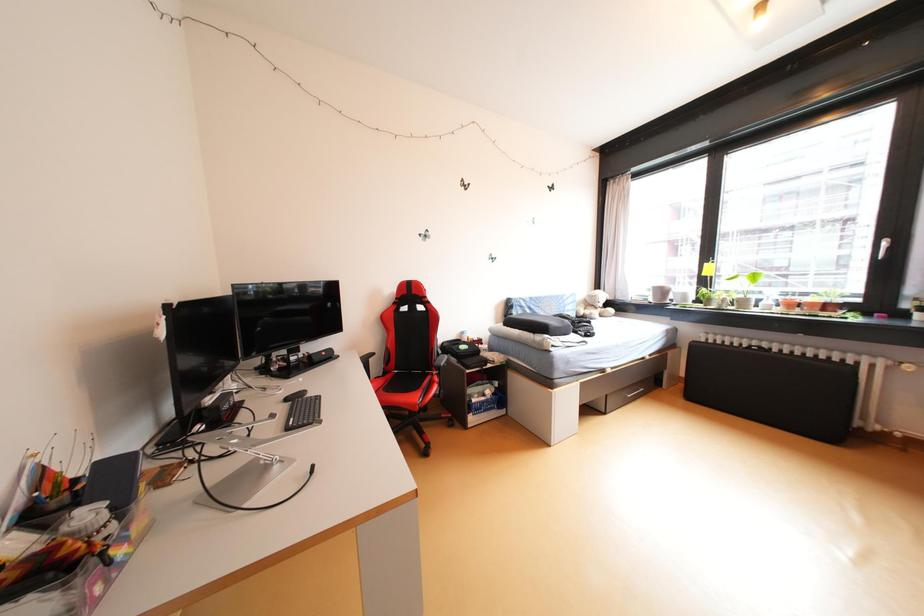
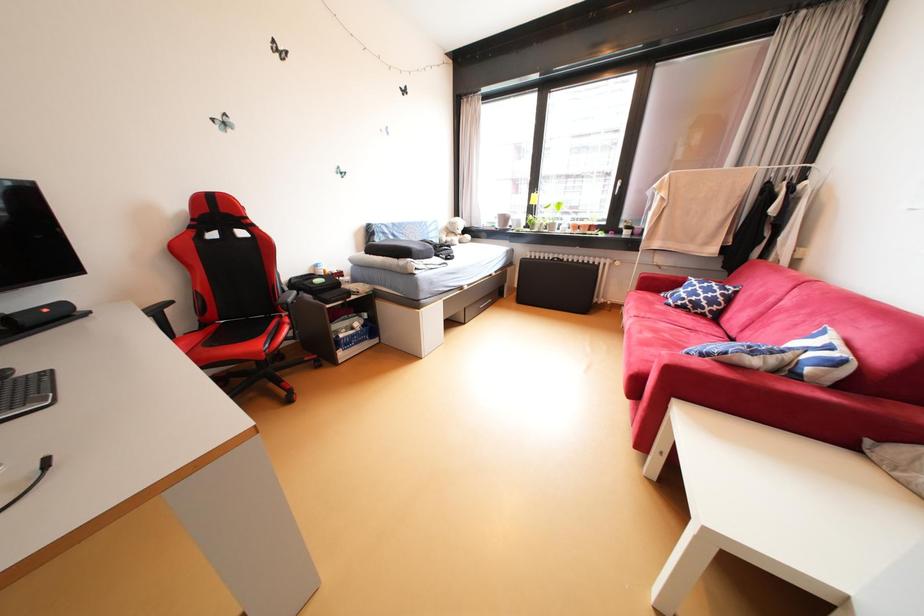
Question: How did the camera likely rotate?

Choices:
 (A) Left
 (B) Right
 (C) Up
 (D) Down

Answer: (B)